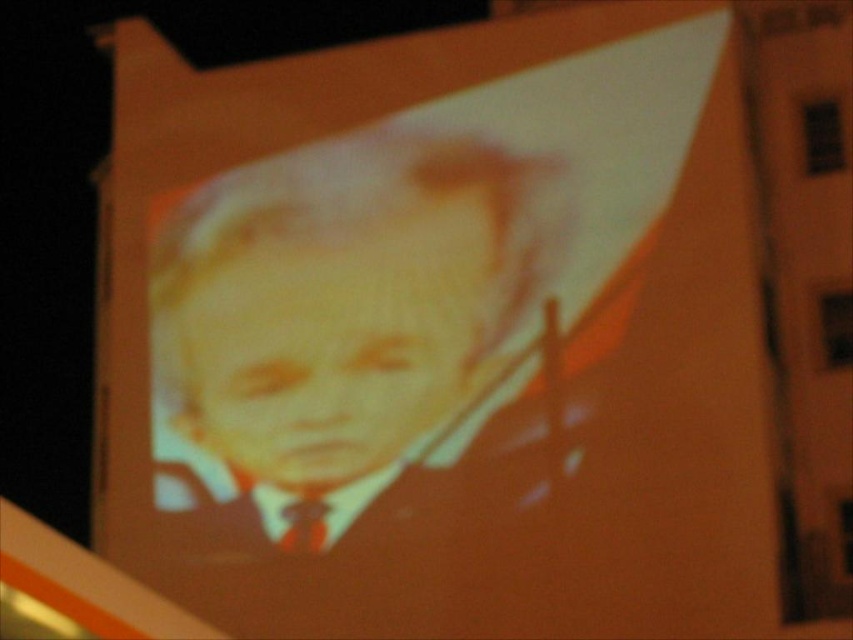
You are an artist planning to install a light sculpture in the building where the face is projected. You have two points marked on the building wall at coordinates point (450, 184) and point (316, 536). Which point is closer to the viewer when standing in front of the building?

Point (316, 536) is closer to the viewer because point (450, 184) is behind it according to the spatial arrangement.

You are an artist trying to place a small sticker on the exact center of the smooth orange face at center. According to the coordinates provided, where should you aim?

The smooth orange face at center is located at point (323, 353), so you should aim for those coordinates to place the sticker exactly at the center.

You are an artist planning to add a new element to the scene. The smooth orange face at center and the matte brown tie at lower center are already present. If you want to place a small sculpture between them, which object should the sculpture be closer to in terms of height?

The smooth orange face at center is much taller than the matte brown tie at lower center, so the sculpture should be placed closer to the matte brown tie at lower center to maintain proportional spacing.